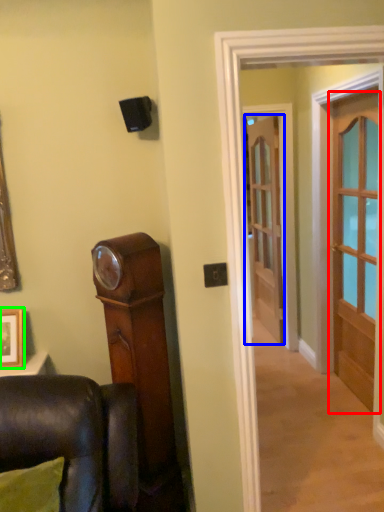
Question: Considering the real-world distances, which object is closest to door (highlighted by a red box)? door (highlighted by a blue box) or picture frame (highlighted by a green box).

Choices:
 (A) door
 (B) picture frame

Answer: (A)